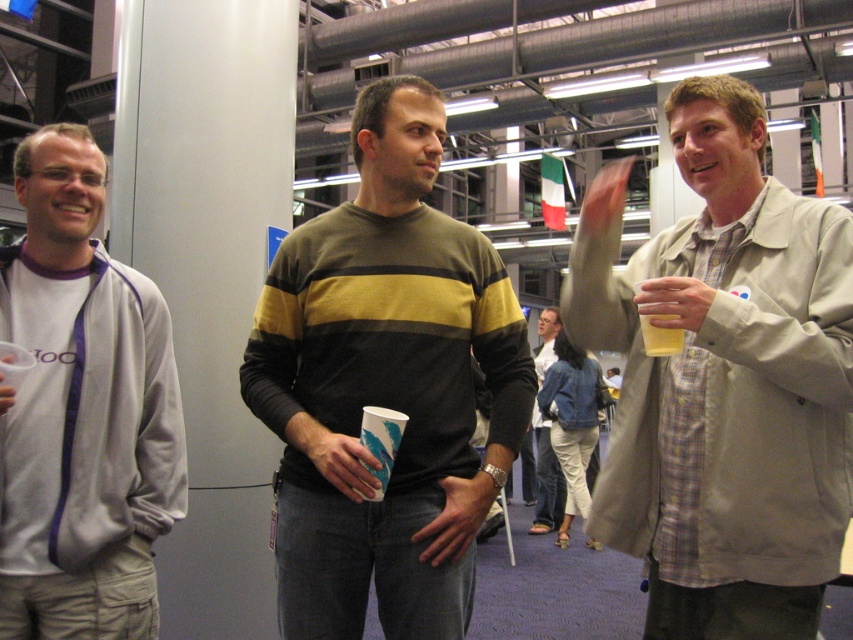
How distant is light beige jacket at right from striped sweater at center?

light beige jacket at right and striped sweater at center are 15.46 inches apart.

Does point (686, 556) lie behind point (384, 168)?

No.

Between point (728, 353) and point (399, 636), which one is positioned in front?

Point (728, 353) is in front.

Locate an element on the screen. This screenshot has width=853, height=640. light beige jacket at right is located at coordinates (723, 381).

Does striped sweater at center have a greater width compared to denim jacket at center?

Yes.

Identify the location of striped sweater at center. (386, 387).

Locate an element on the screen. The height and width of the screenshot is (640, 853). striped sweater at center is located at coordinates (386, 387).

Does striped sweater at center have a smaller size compared to gray fleece jacket at left?

No.

Is striped sweater at center thinner than gray fleece jacket at left?

No, striped sweater at center is not thinner than gray fleece jacket at left.

Is point (421, 621) closer to viewer compared to point (53, 397)?

No.

You are a GUI agent. You are given a task and a screenshot of the screen. Output one action in this format:
    pyautogui.click(x=<x>, y=<y>)
    Task: Click on the striped sweater at center
    Image resolution: width=853 pixels, height=640 pixels.
    Given the screenshot: What is the action you would take?
    pyautogui.click(x=386, y=387)